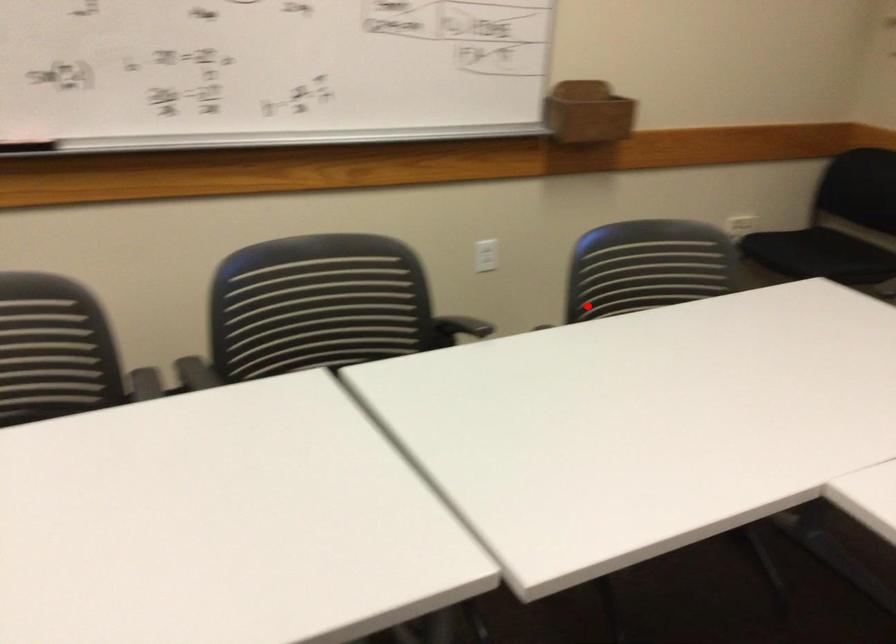
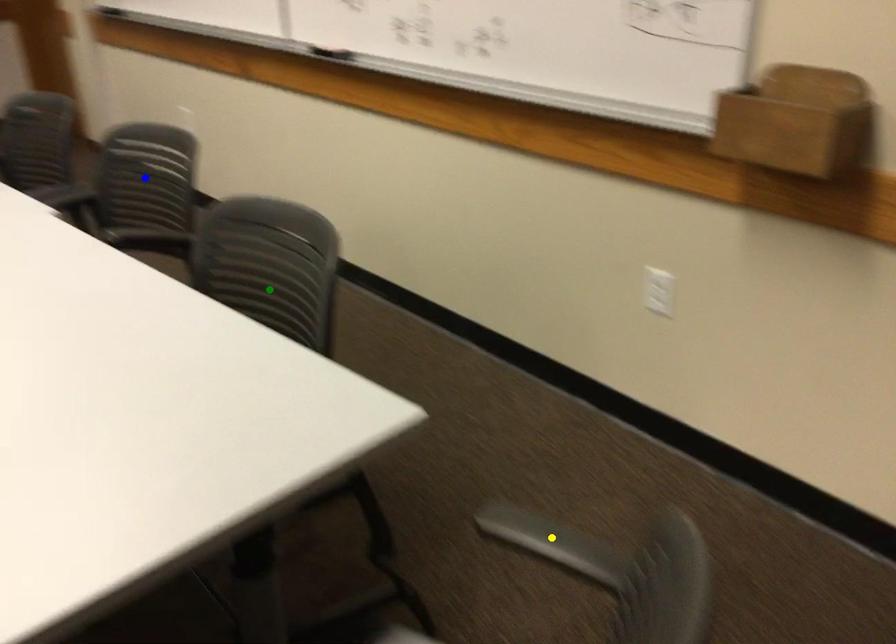
Question: I am providing you with two images of the same scene from different viewpoints. A red point is marked on the first image. You are given multiple points on the second image. In image 2, which mark is for the same physical point as the one in image 1?

Choices:
 (A) yellow point
 (B) green point
 (C) blue point

Answer: (B)